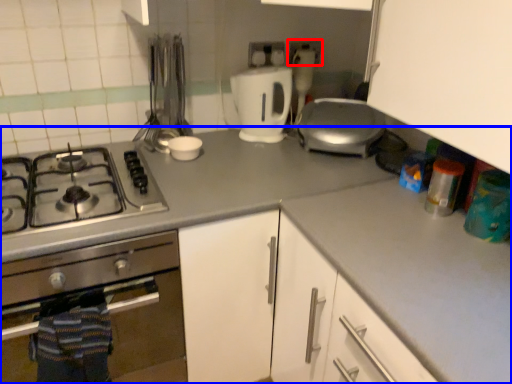
Question: Which point is further to the camera, electric outlet (highlighted by a red box) or countertop (highlighted by a blue box)?

Choices:
 (A) electric outlet
 (B) countertop

Answer: (A)